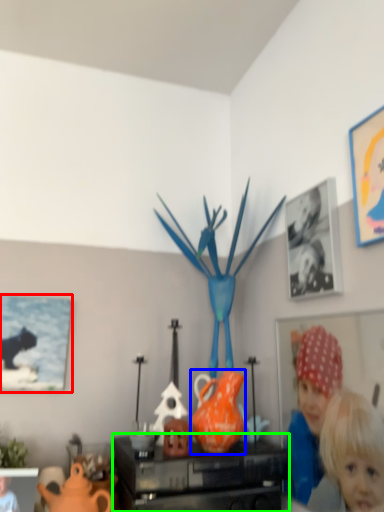
Question: Which is farther away from picture frame (highlighted by a red box)? vase (highlighted by a blue box) or furniture (highlighted by a green box)?

Choices:
 (A) vase
 (B) furniture

Answer: (A)